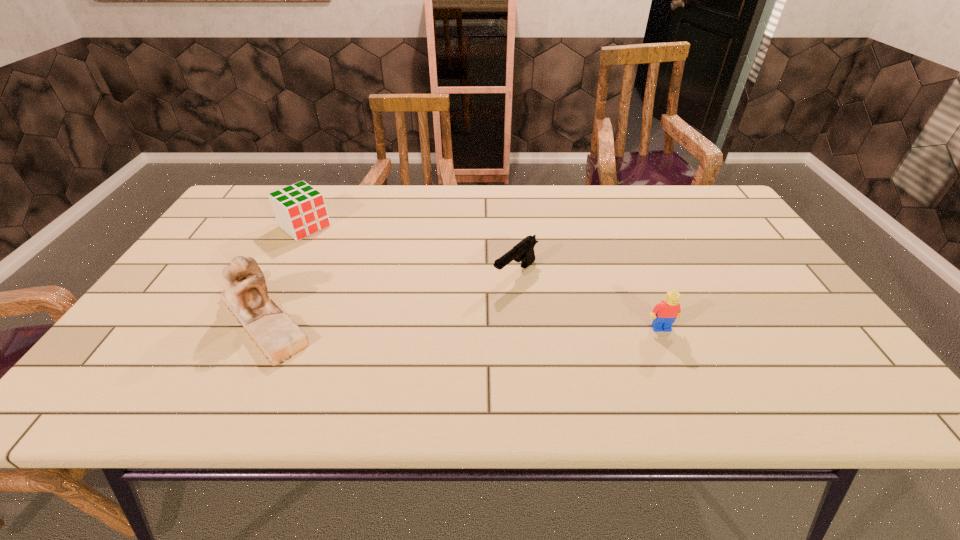
This screenshot has width=960, height=540. What are the coordinates of `vacant space in between the tallest object and the third object from left to right` in the screenshot? It's located at (390, 295).

Point out which object is positioned as the nearest to the farthest object. Please provide its 2D coordinates. Your answer should be formatted as a tuple, i.e. [(x, y)], where the tuple contains the x and y coordinates of a point satisfying the conditions above.

[(274, 332)]

Select which object appears as the second closest to the third object from left to right. Please provide its 2D coordinates. Your answer should be formatted as a tuple, i.e. [(x, y)], where the tuple contains the x and y coordinates of a point satisfying the conditions above.

[(274, 332)]